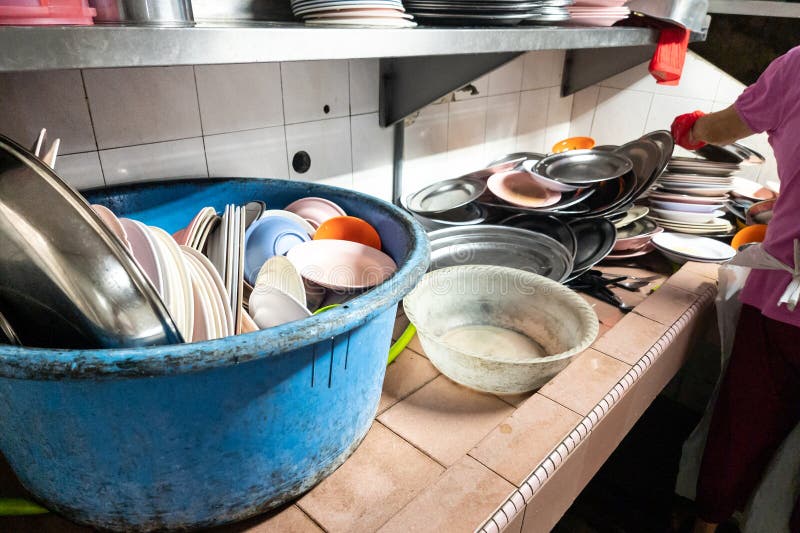
Where is `tile backsplash`? This screenshot has height=533, width=800. tile backsplash is located at coordinates (257, 104), (506, 110), (654, 108), (124, 108).